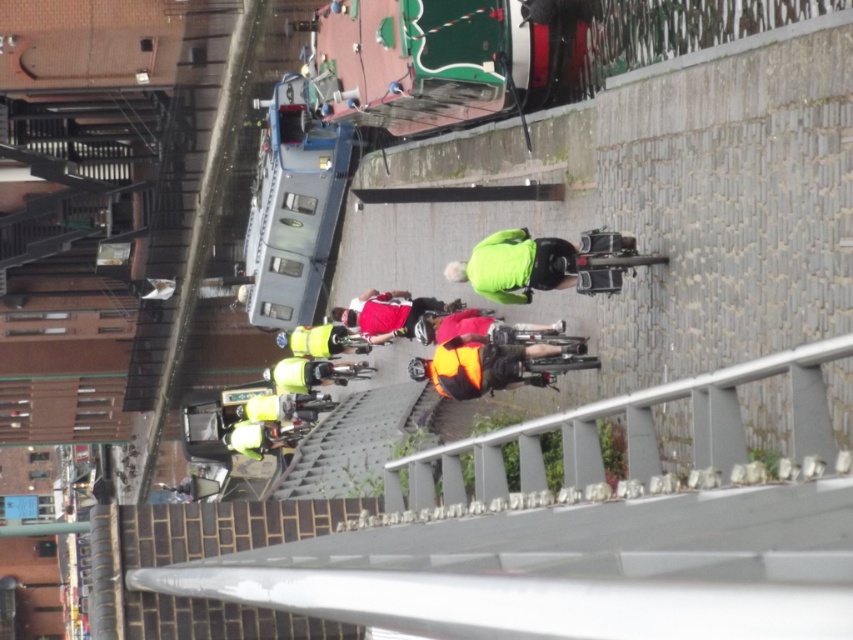
Which is above, reflective red jacket at center or high visibility yellow jacket at center?

Positioned higher is reflective red jacket at center.

Image resolution: width=853 pixels, height=640 pixels. What do you see at coordinates (389, 314) in the screenshot?
I see `reflective red jacket at center` at bounding box center [389, 314].

Find the location of a particular element. The height and width of the screenshot is (640, 853). reflective red jacket at center is located at coordinates (389, 314).

Looking at this image, is high visibility orange vest at center to the right of reflective red jacket at center from the viewer's perspective?

Correct, you'll find high visibility orange vest at center to the right of reflective red jacket at center.

Who is positioned more to the right, high visibility orange vest at center or reflective red jacket at center?

From the viewer's perspective, high visibility orange vest at center appears more on the right side.

Between point (569, 344) and point (415, 310), which one is positioned behind?

Positioned behind is point (415, 310).

This screenshot has width=853, height=640. I want to click on high visibility orange vest at center, so click(x=495, y=365).

Looking at this image, between high visibility orange vest at center and high visibility yellow jacket at center, which one has less height?

Standing shorter between the two is high visibility yellow jacket at center.

Locate an element on the screen. The height and width of the screenshot is (640, 853). high visibility orange vest at center is located at coordinates (495, 365).

You are a GUI agent. You are given a task and a screenshot of the screen. Output one action in this format:
    pyautogui.click(x=<x>, y=<y>)
    Task: Click on the high visibility orange vest at center
    
    Given the screenshot: What is the action you would take?
    pyautogui.click(x=495, y=365)